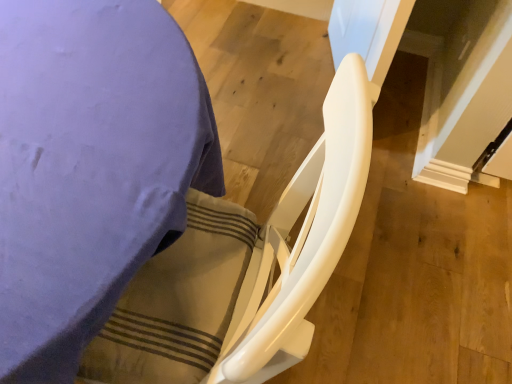
Question: Is white glossy chair at lower right further to camera compared to white glossy rocking chair at center?

Choices:
 (A) yes
 (B) no

Answer: (A)

Question: Is white glossy chair at lower right aimed at white glossy rocking chair at center?

Choices:
 (A) no
 (B) yes

Answer: (B)

Question: Considering the relative sizes of white glossy chair at lower right and white glossy rocking chair at center in the image provided, is white glossy chair at lower right taller than white glossy rocking chair at center?

Choices:
 (A) no
 (B) yes

Answer: (A)

Question: Can we say white glossy chair at lower right lies outside white glossy rocking chair at center?

Choices:
 (A) no
 (B) yes

Answer: (B)

Question: Is white glossy chair at lower right oriented away from white glossy rocking chair at center?

Choices:
 (A) no
 (B) yes

Answer: (A)

Question: Can you confirm if white glossy chair at lower right is positioned to the right of white glossy rocking chair at center?

Choices:
 (A) no
 (B) yes

Answer: (A)

Question: From a real-world perspective, is white glossy rocking chair at center below white glossy chair at lower right?

Choices:
 (A) yes
 (B) no

Answer: (B)

Question: Is white glossy rocking chair at center facing towards white glossy chair at lower right?

Choices:
 (A) yes
 (B) no

Answer: (A)

Question: Is white glossy rocking chair at center further to the viewer compared to white glossy chair at lower right?

Choices:
 (A) yes
 (B) no

Answer: (B)

Question: Are white glossy rocking chair at center and white glossy chair at lower right located far from each other?

Choices:
 (A) yes
 (B) no

Answer: (B)

Question: Is white glossy rocking chair at center taller than white glossy chair at lower right?

Choices:
 (A) yes
 (B) no

Answer: (A)

Question: Does white glossy rocking chair at center have a lesser width compared to white glossy chair at lower right?

Choices:
 (A) yes
 (B) no

Answer: (A)

Question: Is white glossy chair at lower right wider or thinner than white glossy rocking chair at center?

Choices:
 (A) thin
 (B) wide

Answer: (B)